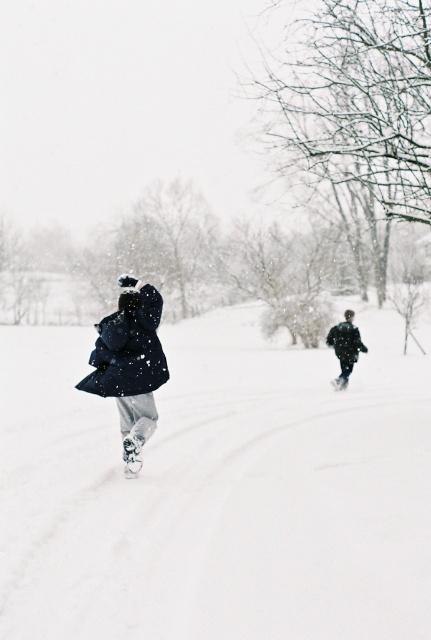
Question: Among these objects, which one is farthest from the camera?

Choices:
 (A) white fluffy snow at center
 (B) dark matte coat at center
 (C) matte black coat at left

Answer: (B)

Question: Is white fluffy snow at center thinner than matte black coat at left?

Choices:
 (A) yes
 (B) no

Answer: (B)

Question: Does white fluffy snow at center come in front of matte black coat at left?

Choices:
 (A) no
 (B) yes

Answer: (B)

Question: Which point is farther to the camera?

Choices:
 (A) dark matte coat at center
 (B) white fluffy snow at center

Answer: (A)

Question: Is white fluffy snow at center wider than dark matte coat at center?

Choices:
 (A) no
 (B) yes

Answer: (B)

Question: Based on their relative distances, which object is farther from the dark matte coat at center?

Choices:
 (A) white fluffy snow at center
 (B) matte black coat at left

Answer: (B)